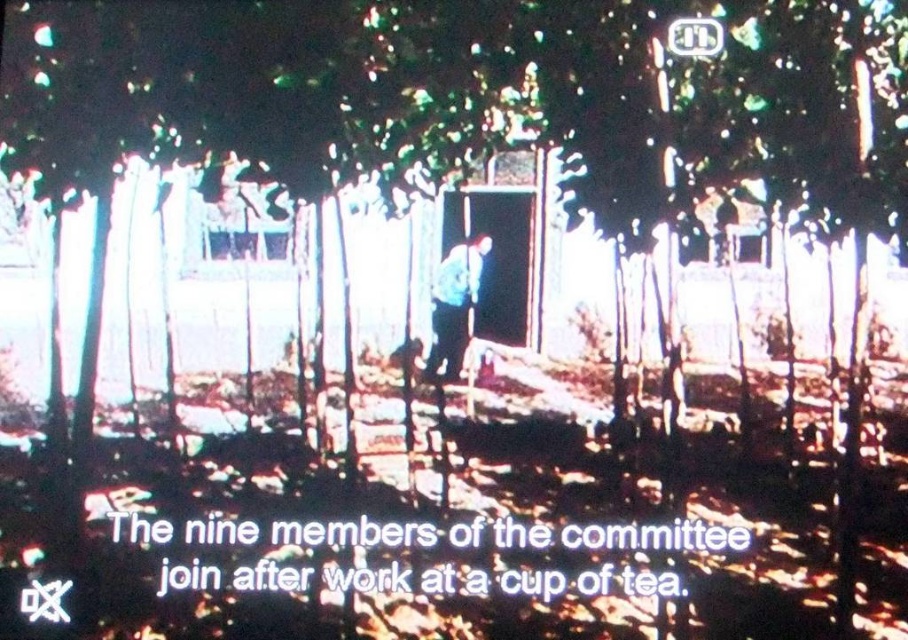
Measure the distance between point (462, 250) and camera.

The distance of point (462, 250) from camera is 10.69 meters.

Between blue denim jacket at center and metallic rectangular at upper center, which one appears on the right side from the viewer's perspective?

metallic rectangular at upper center

Is point (477, 253) more distant than point (691, 52)?

That is False.

Identify the location of blue denim jacket at center. This screenshot has height=640, width=908. (454, 305).